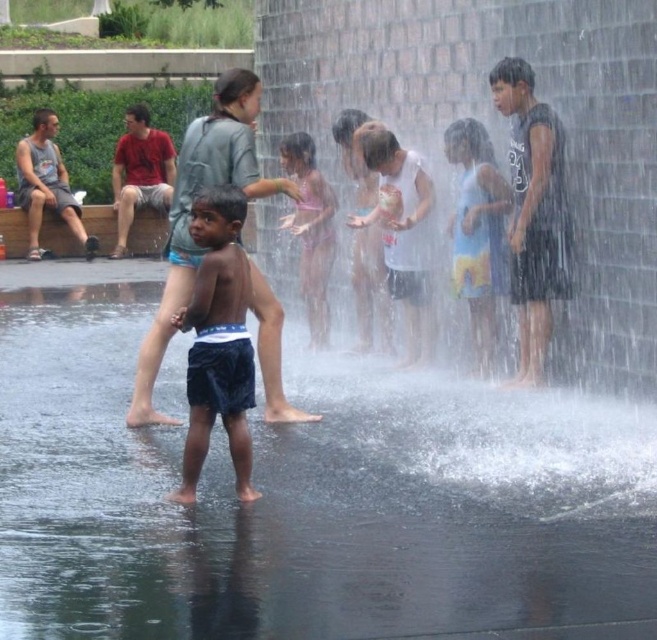
You are standing at point (518,285) and want to take a photo of the water play area. If your camera can focus up to 10 meters away, will it be able to capture the scene clearly?

The distance between point (518,285) and the camera is 9.46 meters, which is within the camera focus range of 10 meters. Therefore, the camera can capture the scene clearly.

You are a photographer trying to capture a clear shot of the pink bikini at center and the gray tank top at left. Which one will appear closer to the camera in the photo?

The pink bikini at center will appear closer to the camera because it is in front of the gray tank top at left.